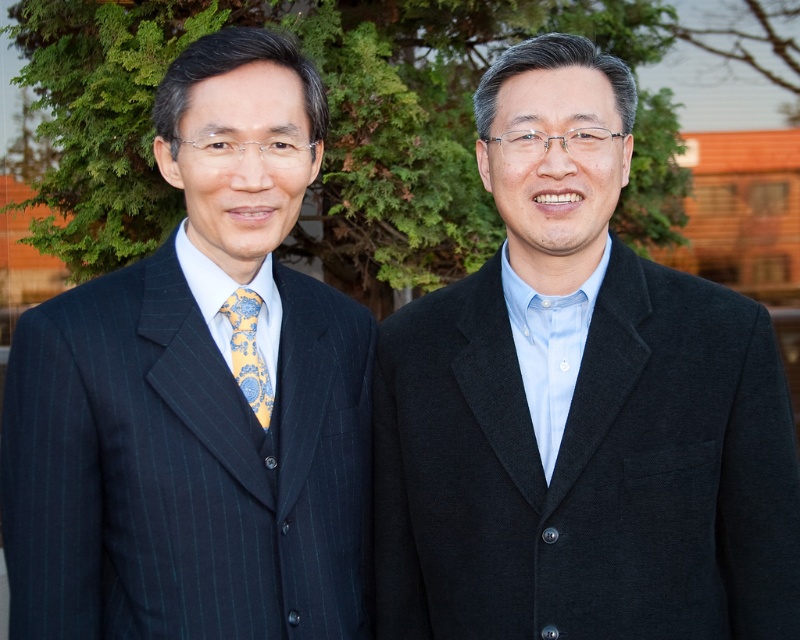
Is point (296, 497) more distant than point (505, 355)?

No, (296, 497) is in front of (505, 355).

Which is more to the left, pinstriped suit at left or dark gray woolen suit at right?

pinstriped suit at left

What are the coordinates of `pinstriped suit at left` in the screenshot? It's located at (197, 396).

Does dark gray woolen suit at right have a greater height compared to yellow floral silk tie at left?

Indeed, dark gray woolen suit at right has a greater height compared to yellow floral silk tie at left.

This screenshot has height=640, width=800. What are the coordinates of `dark gray woolen suit at right` in the screenshot? It's located at (586, 468).

Where is `dark gray woolen suit at right`? The height and width of the screenshot is (640, 800). dark gray woolen suit at right is located at coordinates (586, 468).

Between point (92, 524) and point (236, 340), which one is positioned behind?

The point (236, 340) is behind.

Is point (337, 401) closer to camera compared to point (252, 340)?

No, it is not.

You are a GUI agent. You are given a task and a screenshot of the screen. Output one action in this format:
    pyautogui.click(x=<x>, y=<y>)
    Task: Click on the pinstriped suit at left
    The image size is (800, 640).
    Given the screenshot: What is the action you would take?
    pyautogui.click(x=197, y=396)

This screenshot has height=640, width=800. Find the location of `pinstriped suit at left`. pinstriped suit at left is located at coordinates (x=197, y=396).